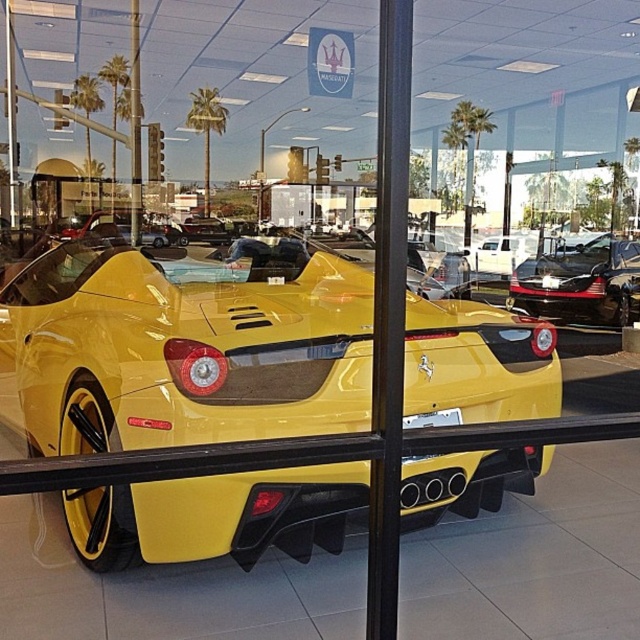
You are a photographer planning to shoot the yellow matte sports car at center and the shiny black car at center in the showroom. Which car should you focus on first if you want to capture reflections from the windows above them?

The yellow matte sports car at center is positioned under the shiny black car at center, so you should focus on the shiny black car at center first to capture its reflections from the windows above.

You are a delivery person who needs to park a delivery van that is 2 meters wide. You see the yellow matte sports car at center and the shiny black car at center in the parking lot. Can you determine if there is enough space between them to park your van?

The yellow matte sports car at center might be wider than shiny black car at center, so there may not be enough space between them to park a 2 meter wide van. Check the actual width before deciding.

You are a delivery person who needs to bring a package to the showroom. The package requires a space of 25 feet to place it between the yellow matte sports car at center and the shiny black car at center. Can you fit the package between them?

The distance between the yellow matte sports car at center and the shiny black car at center is 25.23 feet, so yes, the package requiring 25 feet of space can fit between them as there is enough space available.